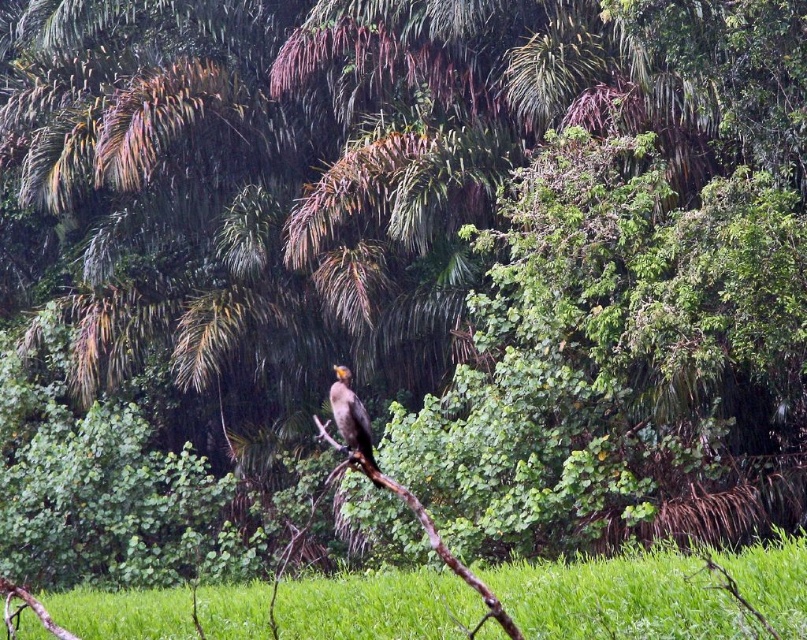
Between point (582, 564) and point (358, 419), which one is positioned in front?

Point (358, 419) is more forward.

Is point (316, 582) farther from viewer compared to point (331, 410)?

Yes, point (316, 582) is farther from viewer.

At what (x,y) coordinates should I click in order to perform the action: click on green grass at lower center. Please return your answer as a coordinate pair (x, y). The height and width of the screenshot is (640, 807). Looking at the image, I should click on (621, 600).

Who is positioned more to the left, brown wood at center or shiny brown bird at center?

From the viewer's perspective, shiny brown bird at center appears more on the left side.

Between brown wood at center and shiny brown bird at center, which one appears on the right side from the viewer's perspective?

brown wood at center is more to the right.

Locate an element on the screen. brown wood at center is located at coordinates (423, 529).

Is green grass at lower center to the left of brown wood at center from the viewer's perspective?

Correct, you'll find green grass at lower center to the left of brown wood at center.

Can you confirm if green grass at lower center is positioned to the right of brown wood at center?

Incorrect, green grass at lower center is not on the right side of brown wood at center.

Is point (730, 627) more distant than point (435, 532)?

That is True.

Locate an element on the screen. This screenshot has width=807, height=640. green grass at lower center is located at coordinates click(621, 600).